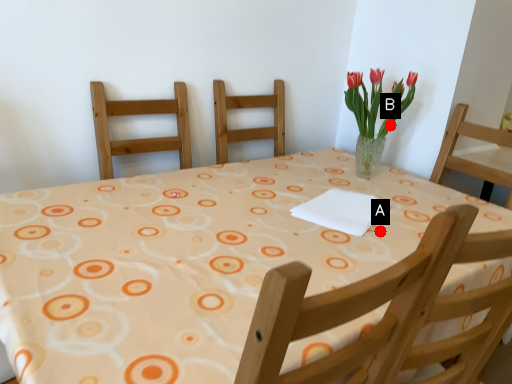
Question: Two points are circled on the image, labeled by A and B beside each circle. Which point is farther to the camera?

Choices:
 (A) A is further
 (B) B is further

Answer: (B)